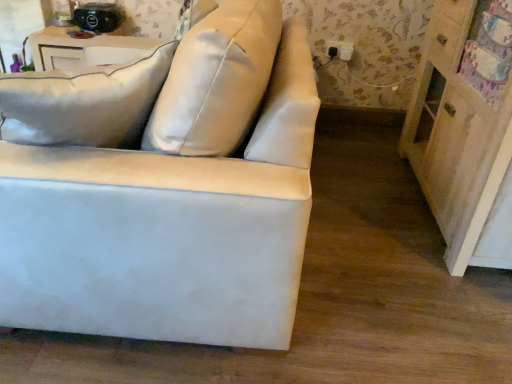
Describe the element at coordinates (84, 49) in the screenshot. The height and width of the screenshot is (384, 512). I see `white wood table at upper left` at that location.

The width and height of the screenshot is (512, 384). What are the coordinates of `wooden dresser at right` in the screenshot? It's located at (465, 131).

The image size is (512, 384). What do you see at coordinates (465, 131) in the screenshot?
I see `wooden dresser at right` at bounding box center [465, 131].

The height and width of the screenshot is (384, 512). Find the location of `white leather couch at center`. white leather couch at center is located at coordinates (164, 189).

What are the coordinates of `black plastic outlet at upper right` in the screenshot? It's located at (340, 50).

From a real-world perspective, between white wood table at upper left and white leather couch at center, who is vertically lower?

From a 3D spatial view, white wood table at upper left is below.

This screenshot has height=384, width=512. I want to click on studio couch in front of the white wood table at upper left, so click(164, 189).

Is white wood table at upper left taller than white leather couch at center?

No, white wood table at upper left is not taller than white leather couch at center.

Does point (189, 334) come in front of point (56, 53)?

That is True.

In terms of size, does white leather couch at center appear bigger or smaller than white wood table at upper left?

Considering their sizes, white leather couch at center takes up more space than white wood table at upper left.

How many degrees apart are the facing directions of white leather couch at center and white wood table at upper left?

The angle between the facing direction of white leather couch at center and the facing direction of white wood table at upper left is 89.4 degrees.

From a real-world perspective, between white leather couch at center and white wood table at upper left, who is vertically higher?

white leather couch at center.

The width and height of the screenshot is (512, 384). I want to click on table below the wooden dresser at right (from a real-world perspective), so click(84, 49).

In terms of size, does wooden dresser at right appear bigger or smaller than white wood table at upper left?

Clearly, wooden dresser at right is larger in size than white wood table at upper left.

Who is shorter, wooden dresser at right or white wood table at upper left?

white wood table at upper left.

Do you think wooden dresser at right is within white wood table at upper left, or outside of it?

wooden dresser at right exists outside the volume of white wood table at upper left.

Could you tell me if black plastic outlet at upper right is facing wooden dresser at right?

No, black plastic outlet at upper right is not aimed at wooden dresser at right.

Between black plastic outlet at upper right and wooden dresser at right, which one is positioned in front?

wooden dresser at right is more forward.

Is black plastic outlet at upper right beside wooden dresser at right?

No, black plastic outlet at upper right is not touching wooden dresser at right.

Choose the correct answer: Is black plastic outlet at upper right inside wooden dresser at right or outside it?

black plastic outlet at upper right is not enclosed by wooden dresser at right.

Is black plastic outlet at upper right shorter than white wood table at upper left?

Yes, black plastic outlet at upper right is shorter than white wood table at upper left.

The width and height of the screenshot is (512, 384). I want to click on table on the left of black plastic outlet at upper right, so click(84, 49).

Is white wood table at upper left surrounded by black plastic outlet at upper right?

No, white wood table at upper left is not inside black plastic outlet at upper right.

Looking at this image, is the depth of black plastic outlet at upper right greater than that of white wood table at upper left?

Yes, it is.

Locate an element on the screen. This screenshot has height=384, width=512. dresser below the white wood table at upper left (from the image's perspective) is located at coordinates [465, 131].

How much distance is there between white wood table at upper left and wooden dresser at right?

white wood table at upper left and wooden dresser at right are 1.42 meters apart from each other.

From a real-world perspective, who is located higher, white wood table at upper left or wooden dresser at right?

wooden dresser at right.

Would you say white wood table at upper left is outside wooden dresser at right?

That's correct, white wood table at upper left is outside of wooden dresser at right.

Is wooden dresser at right facing towards black plastic outlet at upper right?

No, wooden dresser at right is not facing towards black plastic outlet at upper right.

In the scene shown: Is wooden dresser at right located outside black plastic outlet at upper right?

Yes.

The image size is (512, 384). Find the location of `electric outlet that is behind the wooden dresser at right`. electric outlet that is behind the wooden dresser at right is located at coordinates pos(340,50).

Can you confirm if wooden dresser at right is smaller than black plastic outlet at upper right?

Actually, wooden dresser at right might be larger than black plastic outlet at upper right.

In the image, there is a white wood table at upper left. What are the coordinates of `studio couch below it (from the image's perspective)` in the screenshot? It's located at (164, 189).

The width and height of the screenshot is (512, 384). I want to click on table behind the white leather couch at center, so click(x=84, y=49).

Looking at the image, which one is located further to white leather couch at center, black plastic outlet at upper right or white wood table at upper left?

black plastic outlet at upper right is further to white leather couch at center.

Looking at the image, which one is located further to white leather couch at center, black plastic outlet at upper right or wooden dresser at right?

Among the two, black plastic outlet at upper right is located further to white leather couch at center.

Looking at the image, which one is located further to wooden dresser at right, white leather couch at center or white wood table at upper left?

white wood table at upper left lies further to wooden dresser at right than the other object.

Estimate the real-world distances between objects in this image. Which object is closer to black plastic outlet at upper right, white leather couch at center or white wood table at upper left?

white wood table at upper left.

Based on their spatial positions, is wooden dresser at right or white leather couch at center further from white wood table at upper left?

wooden dresser at right is positioned further to the anchor white wood table at upper left.

From the image, which object appears to be farther from wooden dresser at right, black plastic outlet at upper right or white wood table at upper left?

The object further to wooden dresser at right is white wood table at upper left.

Looking at the image, which one is located closer to white wood table at upper left, white leather couch at center or wooden dresser at right?

Among the two, white leather couch at center is located nearer to white wood table at upper left.

Looking at the image, which one is located closer to black plastic outlet at upper right, white leather couch at center or wooden dresser at right?

wooden dresser at right.

Locate an element on the screen. This screenshot has width=512, height=384. dresser between white leather couch at center and black plastic outlet at upper right in the front-back direction is located at coordinates (465, 131).

Image resolution: width=512 pixels, height=384 pixels. In order to click on studio couch between white wood table at upper left and wooden dresser at right in this screenshot , I will do (164, 189).

Locate an element on the screen. The width and height of the screenshot is (512, 384). table positioned between white leather couch at center and black plastic outlet at upper right from near to far is located at coordinates (84, 49).

Locate an element on the screen. electric outlet between white wood table at upper left and wooden dresser at right in the horizontal direction is located at coordinates (340, 50).